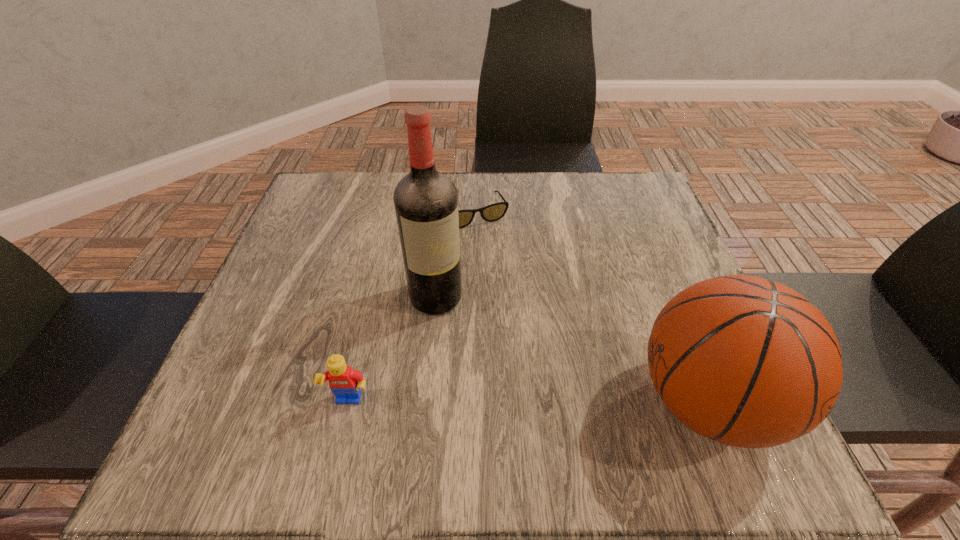
I want to click on free spot on the desktop that is between the third tallest object and the third shortest object and is positioned on the front-facing side of the second farthest object, so click(x=510, y=403).

At what (x,y) coordinates should I click in order to perform the action: click on vacant space on the desktop that is between the Lego and the basketball and is positioned on the front-facing side of the farthest object. Please return your answer as a coordinate pair (x, y). This screenshot has height=540, width=960. Looking at the image, I should click on (572, 403).